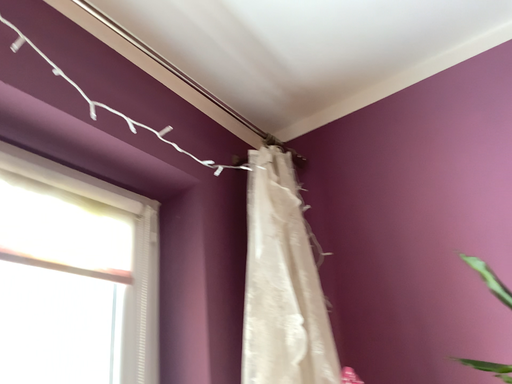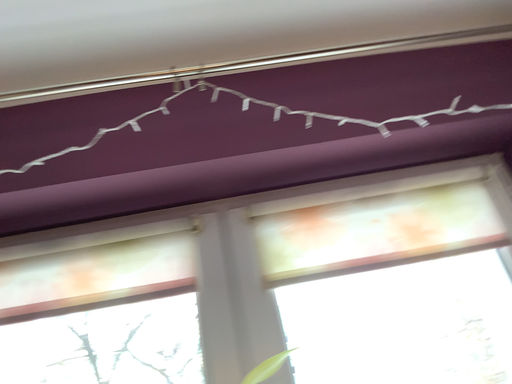
Question: How did the camera likely rotate when shooting the video?

Choices:
 (A) rotated downward
 (B) rotated upward

Answer: (A)